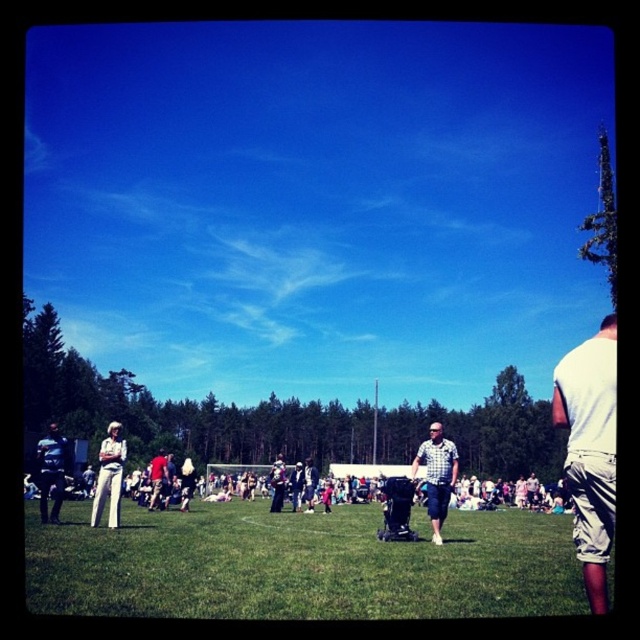
You are planning to set up a picnic blanket in the image. The green grass at center and white cotton shirt at right are both visible. Which area would you choose to place the blanket, considering the space available?

The white cotton shirt at right occupies more space than the green grass at center, so placing the picnic blanket there would provide more room.

You are a photographer trying to capture both the white cotton shirt at right and the dark blue shirt at lower left in a single shot. Since the camera has a limited focus range, which shirt should you focus on to ensure the larger one is clear?

The white cotton shirt at right is larger than the dark blue shirt at lower left, so you should focus on the white cotton shirt at right to ensure it is clear in the photograph.

You are planning to set up a picnic blanket in the middle of the green grass at center. However, you notice the white cotton shirt at right nearby. Considering their widths, which area is narrower?

The green grass at center has a lesser width compared to the white cotton shirt at right, so the green grass at center is narrower.